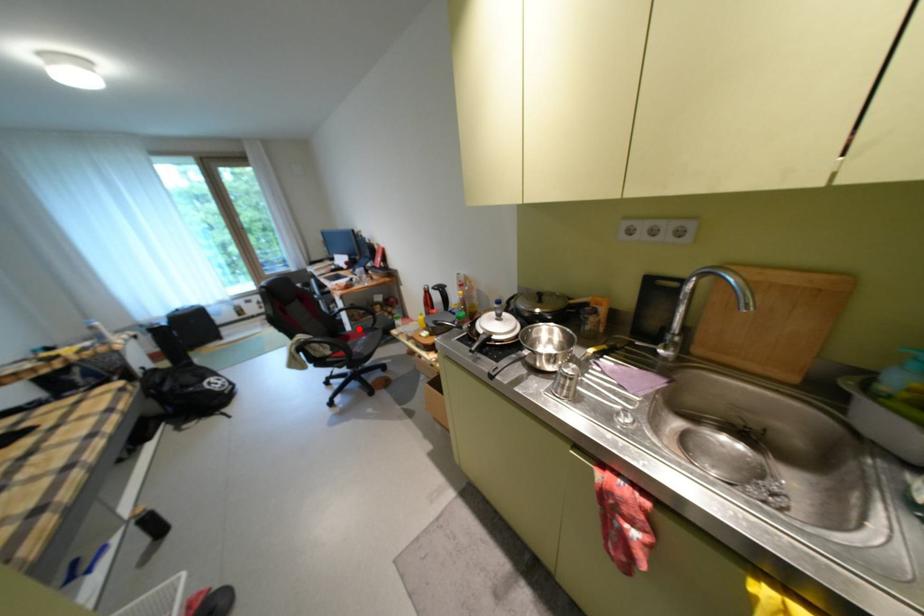
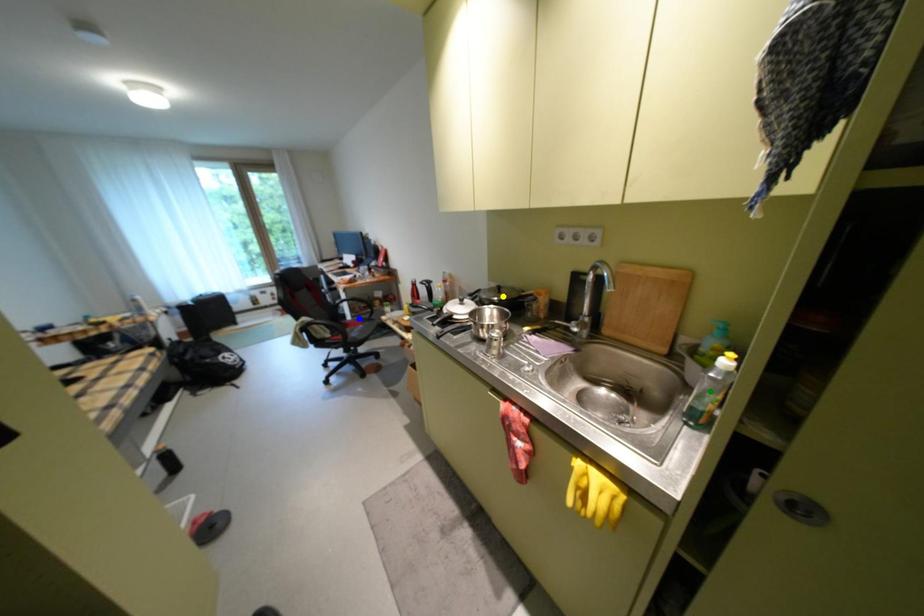
Question: I am providing you with two images of the same scene from different viewpoints. A red point is marked on the first image. You are given multiple points on the second image. In image 2, which mark is for the same physical point as the one in image 1?

Choices:
 (A) green point
 (B) yellow point
 (C) blue point

Answer: (C)